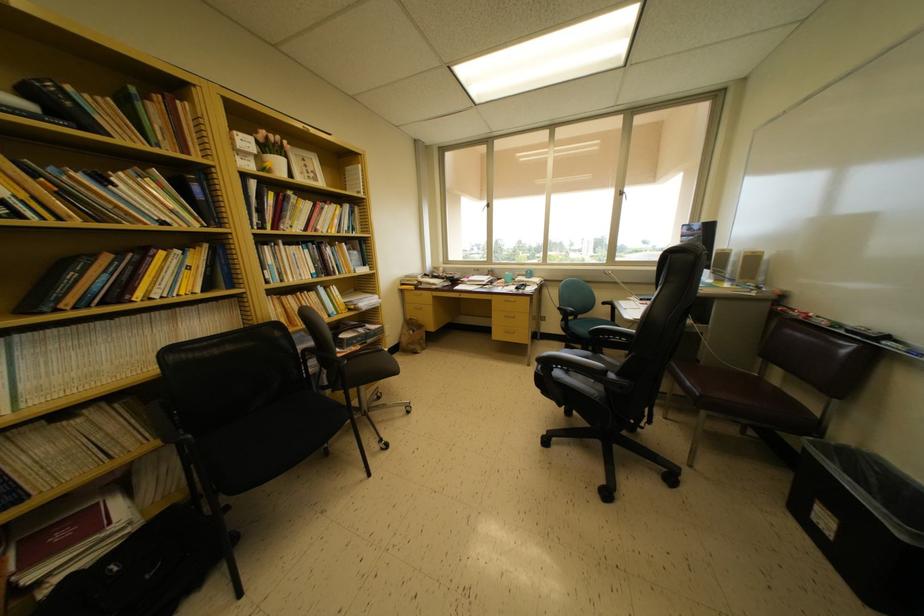
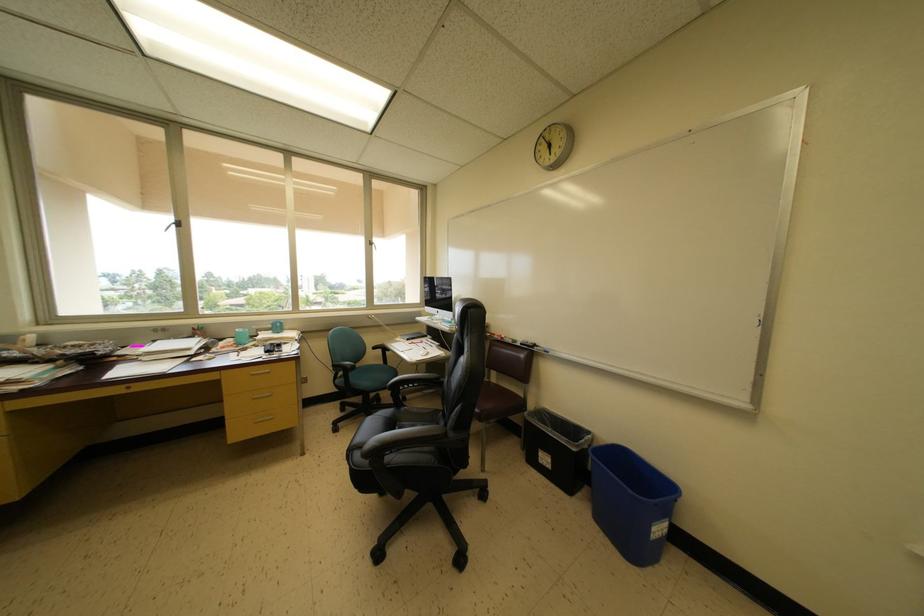
The point at (604, 361) is marked in the first image. Where is the corresponding point in the second image?

(408, 413)